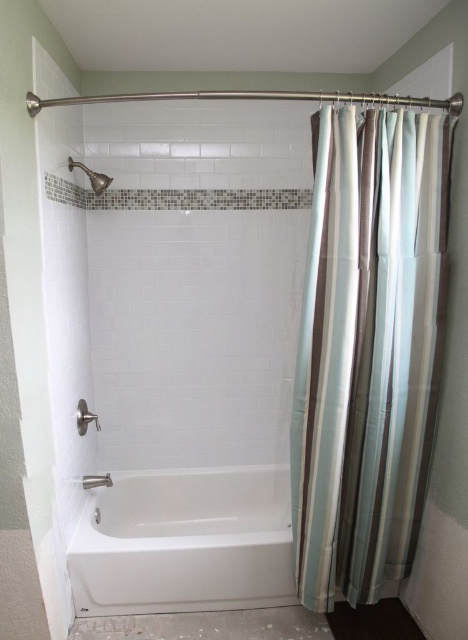
Question: Does striped fabric shower curtain at right have a smaller size compared to brushed metal showerhead at upper left?

Choices:
 (A) no
 (B) yes

Answer: (A)

Question: Is white glossy bathtub at center behind brushed metal showerhead at upper left?

Choices:
 (A) yes
 (B) no

Answer: (B)

Question: Which of the following is the farthest from the observer?

Choices:
 (A) striped fabric shower curtain at right
 (B) brushed metal showerhead at upper left
 (C) white glossy bathtub at center

Answer: (B)

Question: Can you confirm if striped fabric shower curtain at right is positioned to the right of brushed metal showerhead at upper left?

Choices:
 (A) no
 (B) yes

Answer: (B)

Question: Among these objects, which one is nearest to the camera?

Choices:
 (A) brushed metal showerhead at upper left
 (B) white glossy bathtub at center

Answer: (B)

Question: Which point is closer to the camera?

Choices:
 (A) striped fabric shower curtain at right
 (B) white glossy bathtub at center

Answer: (A)